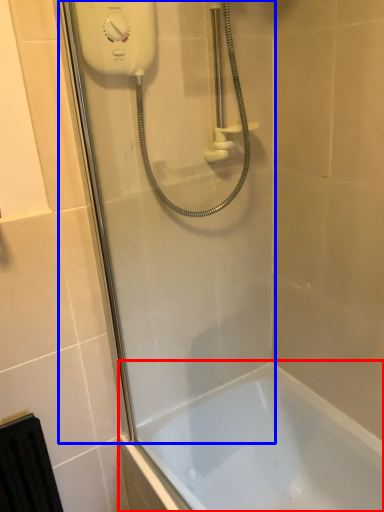
Question: Which object is closer to the camera taking this photo, bathtub (highlighted by a red box) or shower door (highlighted by a blue box)?

Choices:
 (A) bathtub
 (B) shower door

Answer: (B)